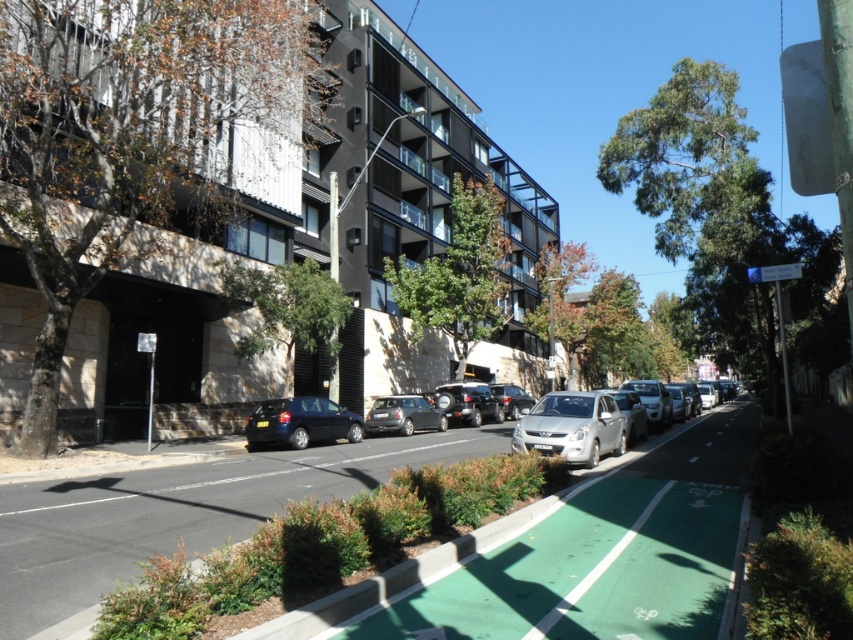
Question: Does shiny dark blue hatchback at center lie behind metallic silver sedan at center?

Choices:
 (A) no
 (B) yes

Answer: (A)

Question: Which object is closer to the camera taking this photo?

Choices:
 (A) metallic silver sedan at center
 (B) green rubber bike lane at center
 (C) shiny dark blue hatchback at center
 (D) silver metallic car at center

Answer: (B)

Question: Is silver metallic car at center closer to the viewer compared to shiny black suv at center?

Choices:
 (A) yes
 (B) no

Answer: (A)

Question: Is green rubber bike lane at center above green rubber bike lane at lower right?

Choices:
 (A) yes
 (B) no

Answer: (A)

Question: Which of the following is the farthest from the observer?

Choices:
 (A) (480, 406)
 (B) (221, 480)

Answer: (A)

Question: Among these points, which one is nearest to the camera?

Choices:
 (A) (270, 436)
 (B) (614, 531)
 (C) (387, 465)
 (D) (616, 451)

Answer: (B)